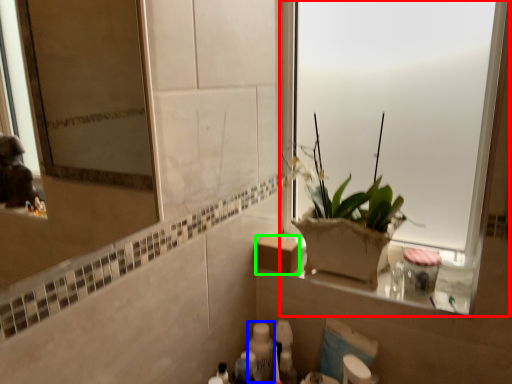
Question: Based on their relative distances, which object is nearer to window (highlighted by a red box)? Choose from toiletry (highlighted by a blue box) and cardboard box (highlighted by a green box).

Choices:
 (A) toiletry
 (B) cardboard box

Answer: (B)